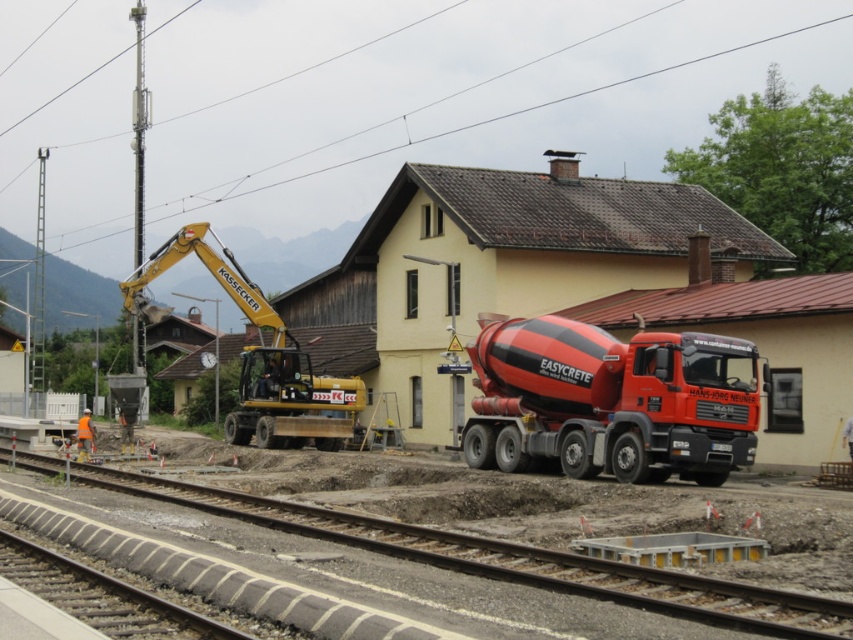
You are a construction supervisor who needs to move the red matte concrete mixer at center and the yellow metallic excavator at left to different locations. If you want to move the thinner machine first, which one should you move first?

The red matte concrete mixer at center is thinner than the yellow metallic excavator at left, so you should move the red matte concrete mixer at center first.

In the scene shown: You are a construction supervisor checking the distance between the yellow excavator labeled KASSECKER and the smooth asphalt track at center. According to safety regulations, the minimum safe distance between heavy machinery and active railway tracks is 10 meters. Is the current distance compliant with the safety standards?

The yellow excavator labeled KASSECKER and the smooth asphalt track at center are 9.62 meters apart. Since the required minimum distance is 10 meters, the current distance is not compliant with safety standards.